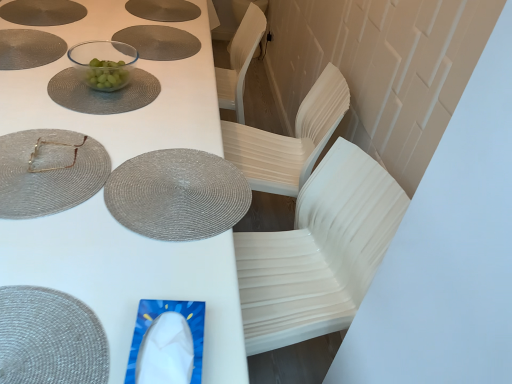
Where is `free spot below matte silver placemat at upper left, the 1th platter in the left-to-right sequence (from a real-world perspective)`? The height and width of the screenshot is (384, 512). free spot below matte silver placemat at upper left, the 1th platter in the left-to-right sequence (from a real-world perspective) is located at coordinates (45, 10).